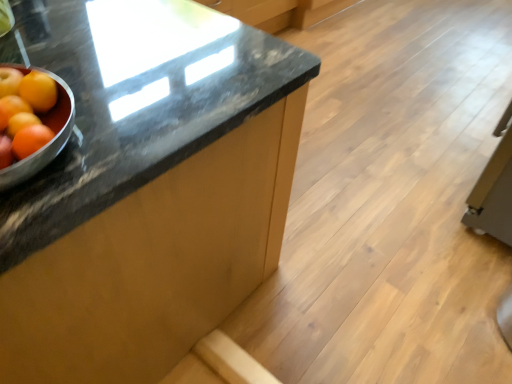
The width and height of the screenshot is (512, 384). I want to click on vacant point to the right of orange matte grapefruit at left, so click(125, 148).